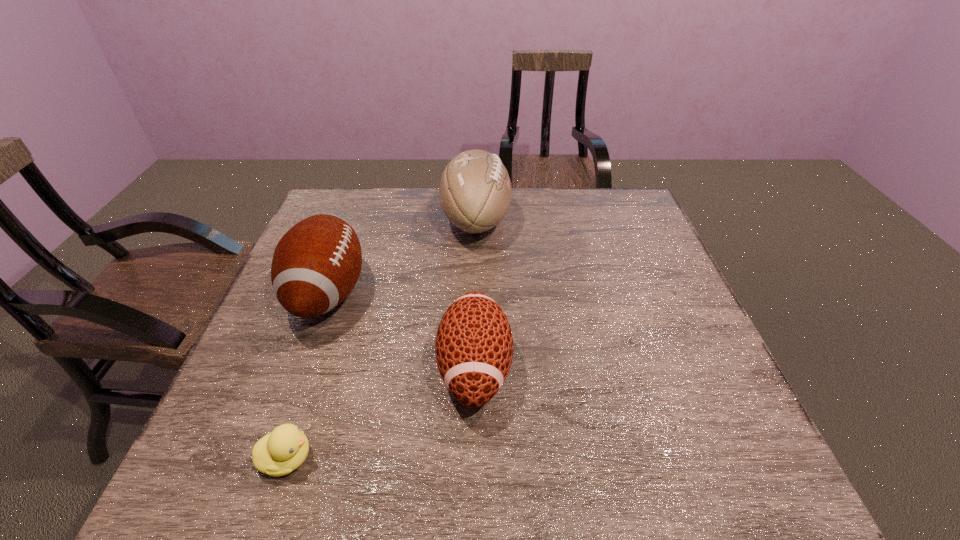
Identify the location of the leftmost football. This screenshot has height=540, width=960. (316, 264).

Find the location of a particular element. The image size is (960, 540). the shortest football is located at coordinates (474, 344).

What are the coordinates of `the shortest object` in the screenshot? It's located at (278, 453).

At what (x,y) coordinates should I click in order to perform the action: click on the nearest object. Please return your answer as a coordinate pair (x, y). Looking at the image, I should click on (278, 453).

In order to click on blank space located 0.320m on the laces of the leftmost football in this screenshot , I will do `click(492, 293)`.

Find the location of a particular element. Image resolution: width=960 pixels, height=540 pixels. free space located on the front of the shortest football is located at coordinates (473, 459).

The width and height of the screenshot is (960, 540). I want to click on vacant position located at the beak of the duckling, so click(490, 458).

Find the location of `object that is at the far edge`. object that is at the far edge is located at coordinates (475, 190).

I want to click on object at the near edge, so click(x=278, y=453).

Where is `football that is positioned at the left edge`? football that is positioned at the left edge is located at coordinates (316, 264).